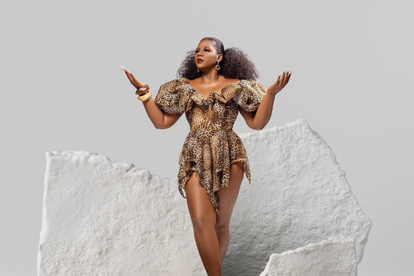
Where is `wall`? This screenshot has height=276, width=414. wall is located at coordinates (58, 80).